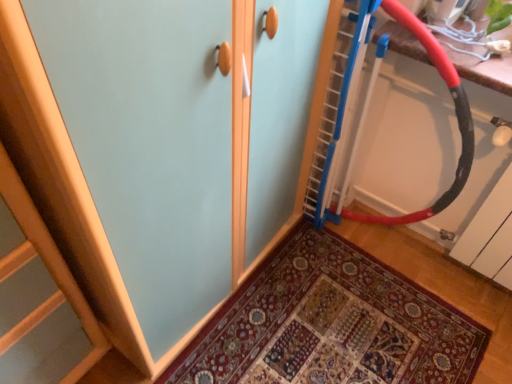
Question: Should I look upward or downward to see red rubber battle rope at upper right?

Choices:
 (A) down
 (B) up

Answer: (B)

Question: From the image's perspective, is red rubber battle rope at upper right above wooden door at center?

Choices:
 (A) yes
 (B) no

Answer: (A)

Question: Is red rubber battle rope at upper right located outside wooden door at center?

Choices:
 (A) yes
 (B) no

Answer: (A)

Question: Is red rubber battle rope at upper right at the right side of wooden door at center?

Choices:
 (A) yes
 (B) no

Answer: (A)

Question: Is wooden door at center at the back of red rubber battle rope at upper right?

Choices:
 (A) yes
 (B) no

Answer: (B)

Question: Can wooden door at center be found inside red rubber battle rope at upper right?

Choices:
 (A) yes
 (B) no

Answer: (B)

Question: Does red rubber battle rope at upper right have a lesser height compared to wooden door at center?

Choices:
 (A) no
 (B) yes

Answer: (A)

Question: Is wooden door at center to the right of red rubber battle rope at upper right from the viewer's perspective?

Choices:
 (A) no
 (B) yes

Answer: (A)

Question: Is wooden door at center looking in the opposite direction of red rubber battle rope at upper right?

Choices:
 (A) yes
 (B) no

Answer: (B)

Question: Considering the relative sizes of wooden door at center and red rubber battle rope at upper right in the image provided, is wooden door at center smaller than red rubber battle rope at upper right?

Choices:
 (A) no
 (B) yes

Answer: (B)

Question: Are wooden door at center and red rubber battle rope at upper right located far from each other?

Choices:
 (A) no
 (B) yes

Answer: (A)

Question: Is wooden door at center surrounding red rubber battle rope at upper right?

Choices:
 (A) yes
 (B) no

Answer: (B)

Question: Does wooden door at center lie in front of red rubber battle rope at upper right?

Choices:
 (A) no
 (B) yes

Answer: (A)

Question: Considering their positions, is wooden door at center located in front of or behind red rubber battle rope at upper right?

Choices:
 (A) behind
 (B) front

Answer: (A)